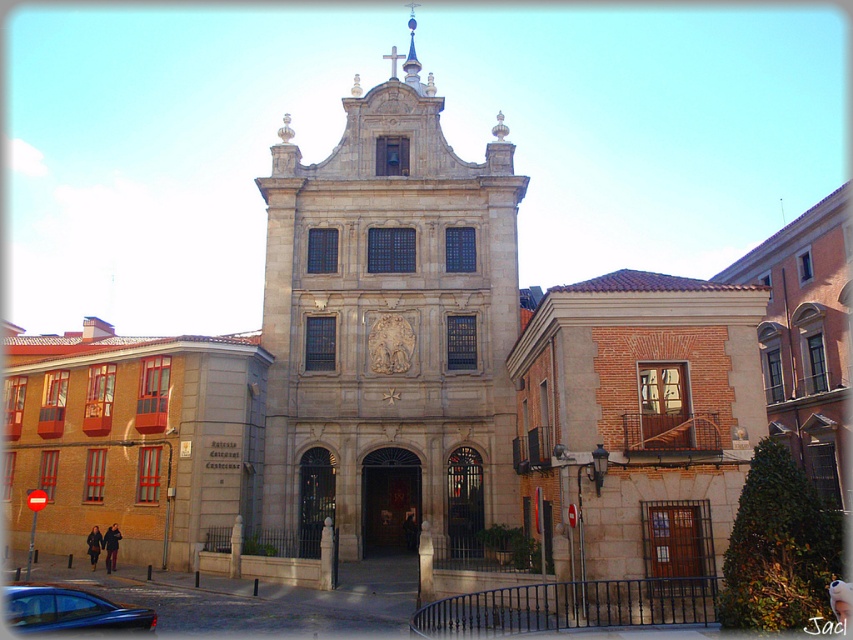
Question: Can you confirm if stone church at center is smaller than shiny black car at lower left?

Choices:
 (A) yes
 (B) no

Answer: (B)

Question: Which of the following is the farthest from the observer?

Choices:
 (A) (154, 611)
 (B) (444, 212)

Answer: (B)

Question: Does stone church at center have a larger size compared to shiny black car at lower left?

Choices:
 (A) yes
 (B) no

Answer: (A)

Question: Can you confirm if stone church at center is positioned to the left of shiny black car at lower left?

Choices:
 (A) no
 (B) yes

Answer: (A)

Question: Which of the following is the farthest from the observer?

Choices:
 (A) (402, 456)
 (B) (57, 602)

Answer: (A)